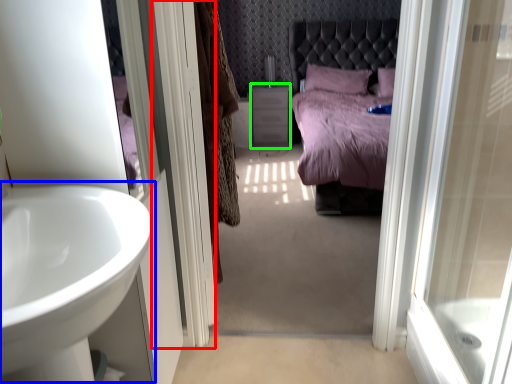
Question: Which object is positioned farthest from screen door (highlighted by a red box)? Select from sink (highlighted by a blue box) and vanity (highlighted by a green box).

Choices:
 (A) sink
 (B) vanity

Answer: (B)